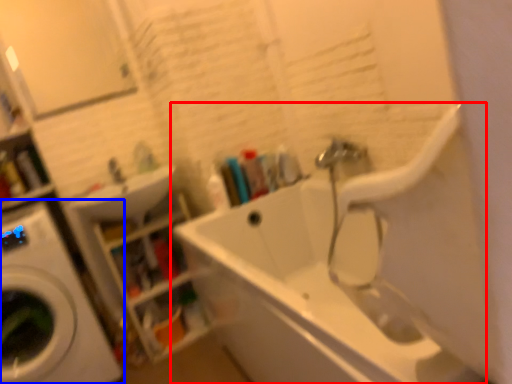
Question: Which object is further to the camera taking this photo, bathtub (highlighted by a red box) or washing machine (highlighted by a blue box)?

Choices:
 (A) bathtub
 (B) washing machine

Answer: (B)